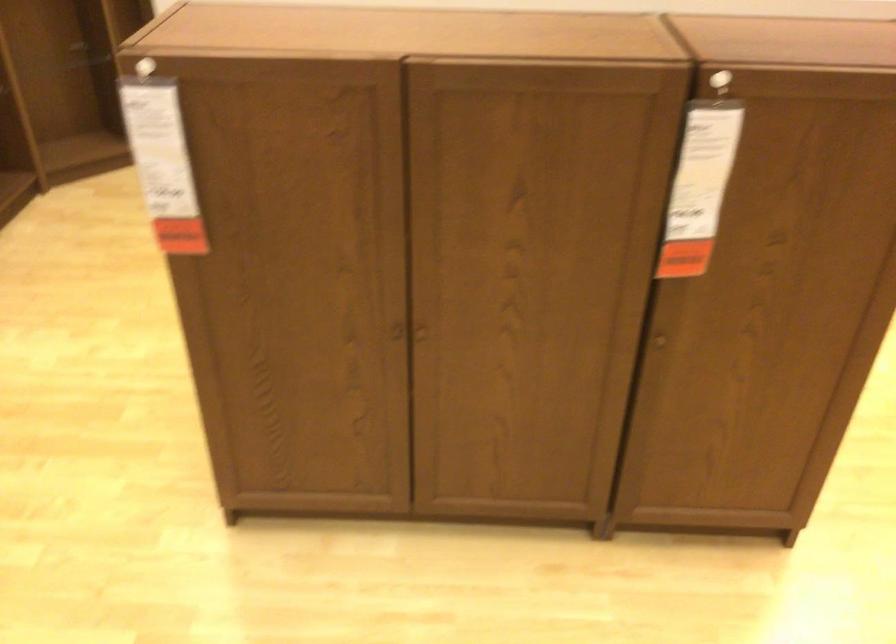
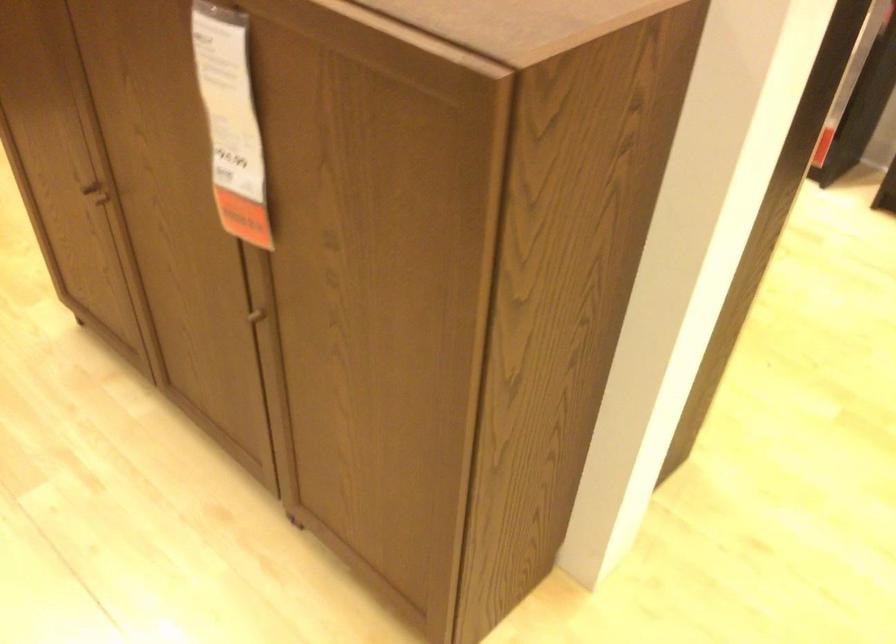
Find the pixel in the second image that matches [659,339] in the first image.

(262, 314)